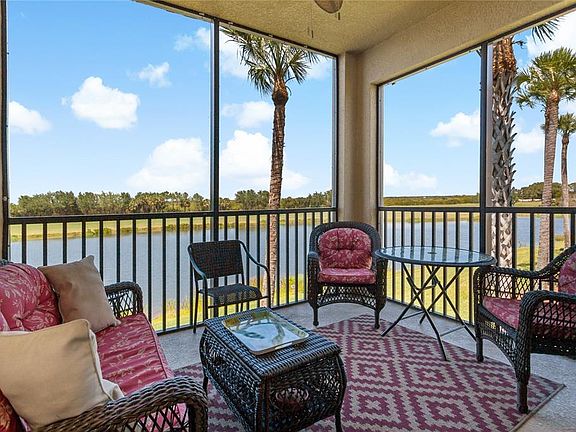
I want to click on coffee table, so click(x=280, y=360).